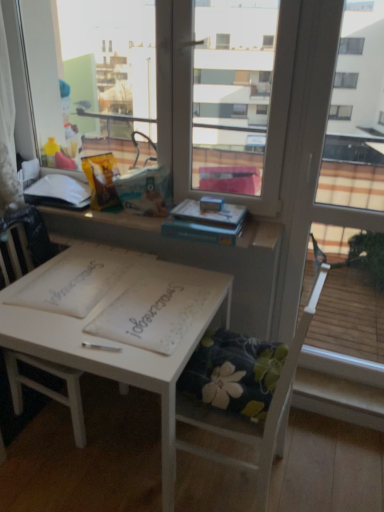
Question: Is hardcover book at upper center, the 1th book in the right-to-left sequence, beside white painted wood table at center?

Choices:
 (A) yes
 (B) no

Answer: (B)

Question: Can you confirm if hardcover book at upper center, the 1th book in the right-to-left sequence, is smaller than white painted wood table at center?

Choices:
 (A) yes
 (B) no

Answer: (A)

Question: Can we say hardcover book at upper center, the 1th book in the right-to-left sequence, lies outside white painted wood table at center?

Choices:
 (A) yes
 (B) no

Answer: (A)

Question: Would you consider hardcover book at upper center, the first book positioned from the front, to be distant from white painted wood table at center?

Choices:
 (A) no
 (B) yes

Answer: (A)

Question: From a real-world perspective, is hardcover book at upper center, which appears as the second book when viewed from the back, located beneath white painted wood table at center?

Choices:
 (A) yes
 (B) no

Answer: (B)

Question: Would you say hardcover book at upper center, which appears as the second book when viewed from the back, contains white painted wood table at center?

Choices:
 (A) yes
 (B) no

Answer: (B)

Question: Is white matte book at upper left, marked as the 1th book in a back-to-front arrangement, facing away from white wood chair at center, positioned as the second chair in right-to-left order?

Choices:
 (A) no
 (B) yes

Answer: (A)

Question: From a real-world perspective, is white matte book at upper left, marked as the 1th book in a back-to-front arrangement, over white wood chair at center, positioned as the second chair in right-to-left order?

Choices:
 (A) no
 (B) yes

Answer: (B)

Question: Does white matte book at upper left, the first book in the left-to-right sequence, have a lesser height compared to white wood chair at center, which is the 1th chair in left-to-right order?

Choices:
 (A) yes
 (B) no

Answer: (A)

Question: Can white wood chair at center, positioned as the second chair in right-to-left order, be found inside white matte book at upper left, marked as the 1th book in a back-to-front arrangement?

Choices:
 (A) no
 (B) yes

Answer: (A)

Question: Does white matte book at upper left, marked as the 1th book in a back-to-front arrangement, appear on the left side of white wood chair at center, which is the 1th chair in left-to-right order?

Choices:
 (A) no
 (B) yes

Answer: (B)

Question: Considering the relative positions of white matte book at upper left, marked as the 1th book in a back-to-front arrangement, and white wood chair at center, which is the 1th chair in left-to-right order, in the image provided, is white matte book at upper left, marked as the 1th book in a back-to-front arrangement, to the right of white wood chair at center, which is the 1th chair in left-to-right order, from the viewer's perspective?

Choices:
 (A) no
 (B) yes

Answer: (A)

Question: Is white matte book at upper left, the first book in the left-to-right sequence, positioned with its back to white paper notebook at center, which appears as the second notebook when viewed from the left?

Choices:
 (A) no
 (B) yes

Answer: (A)